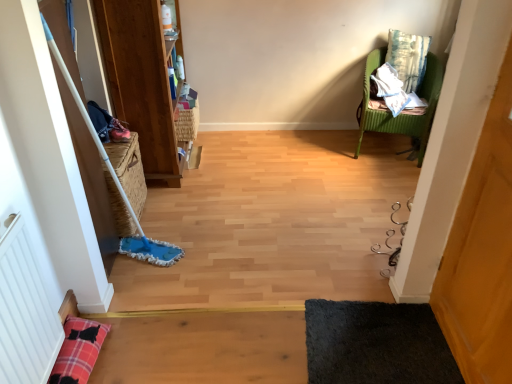
Locate an element on the screen. green ribbed chair at upper right is located at coordinates (401, 114).

Image resolution: width=512 pixels, height=384 pixels. I want to click on textured blue-green pillow at upper right, so click(x=408, y=57).

The height and width of the screenshot is (384, 512). Describe the element at coordinates (482, 252) in the screenshot. I see `wooden screen door at right` at that location.

At what (x,y) coordinates should I click in order to perform the action: click on woven straw basket at left, which is the first basket from bottom to top. Please return your answer as a coordinate pair (x, y). The height and width of the screenshot is (384, 512). Looking at the image, I should click on (129, 170).

Identify the location of green ribbed chair at upper right. (401, 114).

Is point (127, 193) positioned after point (6, 310)?

Yes, it is.

Considering the relative sizes of woven straw basket at left, which ranks as the 1th basket in left-to-right order, and white textured radiator at lower left in the image provided, is woven straw basket at left, which ranks as the 1th basket in left-to-right order, thinner than white textured radiator at lower left?

No, woven straw basket at left, which ranks as the 1th basket in left-to-right order, is not thinner than white textured radiator at lower left.

Is woven straw basket at left, the 2th basket in the back-to-front sequence, at the left side of white textured radiator at lower left?

Indeed, woven straw basket at left, the 2th basket in the back-to-front sequence, is positioned on the left side of white textured radiator at lower left.

Is woven straw basket at left, which is the 2th basket from top to bottom, surrounding white textured radiator at lower left?

No, woven straw basket at left, which is the 2th basket from top to bottom, does not contain white textured radiator at lower left.

Which is in front, woven brown basket at upper center, acting as the 2th basket starting from the front, or woven straw basket at left, which is the first basket from bottom to top?

Positioned in front is woven straw basket at left, which is the first basket from bottom to top.

Are woven brown basket at upper center, the first basket when ordered from right to left, and woven straw basket at left, which appears as the 1th basket when viewed from the front, far apart?

They are positioned close to each other.

Can we say woven brown basket at upper center, the first basket when ordered from right to left, lies outside woven straw basket at left, the second basket from the right?

Yes, woven brown basket at upper center, the first basket when ordered from right to left, is located beyond the bounds of woven straw basket at left, the second basket from the right.

Consider the image. From a real-world perspective, is woven brown basket at upper center, positioned as the second basket in left-to-right order, located higher than woven straw basket at left, the second basket from the right?

Yes, from a real-world perspective, woven brown basket at upper center, positioned as the second basket in left-to-right order, is above woven straw basket at left, the second basket from the right.

In terms of height, does woven straw basket at left, which is the first basket from bottom to top, look taller or shorter compared to black shaggy rug at lower right?

Considering their sizes, woven straw basket at left, which is the first basket from bottom to top, has more height than black shaggy rug at lower right.

Can you see woven straw basket at left, which is the first basket from bottom to top, touching black shaggy rug at lower right?

woven straw basket at left, which is the first basket from bottom to top, is not next to black shaggy rug at lower right, and they're not touching.

Is point (142, 208) closer or farther from the camera than point (373, 352)?

Point (142, 208) appears to be farther away from the viewer than point (373, 352).

How far apart are woven straw basket at left, which is the first basket from bottom to top, and black shaggy rug at lower right?

woven straw basket at left, which is the first basket from bottom to top, is 1.29 meters away from black shaggy rug at lower right.

From a real-world perspective, does woven brown basket at upper center, arranged as the first basket when viewed from the back, sit lower than white textured radiator at lower left?

Yes, from a real-world perspective, woven brown basket at upper center, arranged as the first basket when viewed from the back, is beneath white textured radiator at lower left.

Is woven brown basket at upper center, the 2th basket in the bottom-to-top sequence, oriented towards white textured radiator at lower left?

No, woven brown basket at upper center, the 2th basket in the bottom-to-top sequence, is not aimed at white textured radiator at lower left.

How many degrees apart are the facing directions of woven brown basket at upper center, arranged as the first basket when viewed from the back, and white textured radiator at lower left?

woven brown basket at upper center, arranged as the first basket when viewed from the back, and white textured radiator at lower left are facing 0.354 degrees away from each other.

Between point (420, 137) and point (346, 343), which one is positioned behind?

Point (420, 137)

Does green ribbed chair at upper right contain black shaggy rug at lower right?

No, black shaggy rug at lower right is located outside of green ribbed chair at upper right.

Is green ribbed chair at upper right taller or shorter than black shaggy rug at lower right?

green ribbed chair at upper right is taller than black shaggy rug at lower right.

Which object is closer to the camera, green ribbed chair at upper right or black shaggy rug at lower right?

Positioned in front is black shaggy rug at lower right.

Where is `material above the woven straw basket at left, which ranks as the 1th basket in left-to-right order (from a real-world perspective)`? material above the woven straw basket at left, which ranks as the 1th basket in left-to-right order (from a real-world perspective) is located at coordinates (394, 90).

Could you tell me if green textured cushion at upper right is facing woven straw basket at left, the 2th basket in the back-to-front sequence?

No, green textured cushion at upper right is not aimed at woven straw basket at left, the 2th basket in the back-to-front sequence.

Looking at this image, in the image, is green textured cushion at upper right positioned in front of or behind woven straw basket at left, which is the 2th basket from top to bottom?

green textured cushion at upper right is positioned farther from the viewer than woven straw basket at left, which is the 2th basket from top to bottom.

Is green textured cushion at upper right not near woven straw basket at left, the second basket from the right?

That's right, there is a large distance between green textured cushion at upper right and woven straw basket at left, the second basket from the right.

Is woven straw basket at left, the 2th basket in the back-to-front sequence, inside or outside of green ribbed chair at upper right?

woven straw basket at left, the 2th basket in the back-to-front sequence, is located beyond the bounds of green ribbed chair at upper right.

Which of these two, woven straw basket at left, which appears as the 1th basket when viewed from the front, or green ribbed chair at upper right, is bigger?

green ribbed chair at upper right is bigger.

Is woven straw basket at left, which appears as the 1th basket when viewed from the front, next to green ribbed chair at upper right and touching it?

woven straw basket at left, which appears as the 1th basket when viewed from the front, and green ribbed chair at upper right are not in contact.

Find the location of `the 1st basket behind the white textured radiator at lower left, counting from the anchor's position`. the 1st basket behind the white textured radiator at lower left, counting from the anchor's position is located at coordinates (129, 170).

You are a GUI agent. You are given a task and a screenshot of the screen. Output one action in this format:
    pyautogui.click(x=<x>, y=<y>)
    Task: Click on the basket located below the woven brown basket at upper center, acting as the 2th basket starting from the front (from the image's perspective)
    This screenshot has height=384, width=512.
    Given the screenshot: What is the action you would take?
    pyautogui.click(x=129, y=170)

Looking at the image, which one is located closer to wooden bookshelf at left, white textured radiator at lower left or textured blue-green pillow at upper right?

white textured radiator at lower left.

Estimate the real-world distances between objects in this image. Which object is closer to woven straw basket at left, which ranks as the 1th basket in left-to-right order, textured blue-green pillow at upper right or woven brown basket at upper center, which is counted as the 1th basket, starting from the top?

The object closer to woven straw basket at left, which ranks as the 1th basket in left-to-right order, is woven brown basket at upper center, which is counted as the 1th basket, starting from the top.

Looking at the image, which one is located further to black shaggy rug at lower right, wooden screen door at right or wooden bookshelf at left?

wooden bookshelf at left is further to black shaggy rug at lower right.

From the image, which object appears to be nearer to black shaggy rug at lower right, green textured cushion at upper right or woven brown basket at upper center, acting as the 2th basket starting from the front?

woven brown basket at upper center, acting as the 2th basket starting from the front.

From the image, which object appears to be nearer to woven straw basket at left, the 2th basket in the back-to-front sequence, wooden screen door at right or green ribbed chair at upper right?

Based on the image, wooden screen door at right appears to be nearer to woven straw basket at left, the 2th basket in the back-to-front sequence.

When comparing their distances from textured blue-green pillow at upper right, does wooden screen door at right or green ribbed chair at upper right seem further?

wooden screen door at right is positioned further to the anchor textured blue-green pillow at upper right.

Considering their positions, is woven brown basket at upper center, arranged as the first basket when viewed from the back, positioned closer to woven straw basket at left, the 2th basket in the back-to-front sequence, than wooden screen door at right?

woven brown basket at upper center, arranged as the first basket when viewed from the back, is positioned closer to the anchor woven straw basket at left, the 2th basket in the back-to-front sequence.

Estimate the real-world distances between objects in this image. Which object is further from black shaggy rug at lower right, woven brown basket at upper center, positioned as the second basket in left-to-right order, or green ribbed chair at upper right?

woven brown basket at upper center, positioned as the second basket in left-to-right order, lies further to black shaggy rug at lower right than the other object.

At what (x,y) coordinates should I click in order to perform the action: click on bookshelf between wooden screen door at right and textured blue-green pillow at upper right along the z-axis. Please return your answer as a coordinate pair (x, y). The width and height of the screenshot is (512, 384). Looking at the image, I should click on (141, 80).

Where is `furniture between wooden bookshelf at left and textured blue-green pillow at upper right in the horizontal direction`? furniture between wooden bookshelf at left and textured blue-green pillow at upper right in the horizontal direction is located at coordinates (401, 114).

Find the location of a particular element. Image resolution: width=512 pixels, height=384 pixels. bookshelf between wooden screen door at right and green textured cushion at upper right in the front-back direction is located at coordinates coord(141,80).

You are a GUI agent. You are given a task and a screenshot of the screen. Output one action in this format:
    pyautogui.click(x=<x>, y=<y>)
    Task: Click on the yoga mat located between woven straw basket at left, the 2th basket in the back-to-front sequence, and green ribbed chair at upper right in the left-right direction
    The width and height of the screenshot is (512, 384).
    Given the screenshot: What is the action you would take?
    pyautogui.click(x=376, y=344)